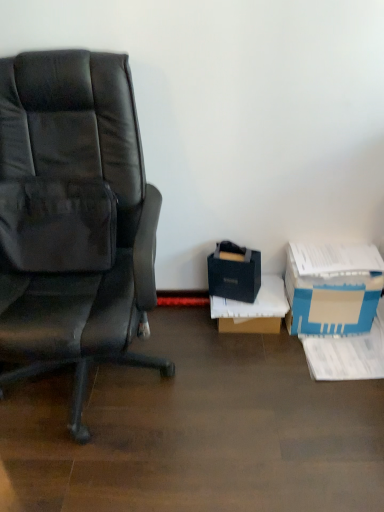
Question: Considering their positions, is black matte bag at lower right, placed as the 1th box when sorted from left to right, located in front of or behind black matte box at lower right, which is the 2th box from left to right?

Choices:
 (A) front
 (B) behind

Answer: (A)

Question: Would you say black matte bag at lower right, the 3th box in the right-to-left sequence, is inside or outside black matte box at lower right, acting as the 2th box starting from the right?

Choices:
 (A) outside
 (B) inside

Answer: (A)

Question: Which is farther from the black matte bag at lower right, the 3th box in the right-to-left sequence?

Choices:
 (A) blue cardboard box at lower right, which is the 3th box in left-to-right order
 (B) black matte box at lower right, acting as the 2th box starting from the right
 (C) matte black chair at left

Answer: (C)

Question: Based on their relative distances, which object is farther from the matte black chair at left?

Choices:
 (A) blue cardboard box at lower right, the first box in the right-to-left sequence
 (B) black matte bag at lower right, placed as the 1th box when sorted from left to right
 (C) black matte box at lower right, which is the 2th box from left to right

Answer: (A)